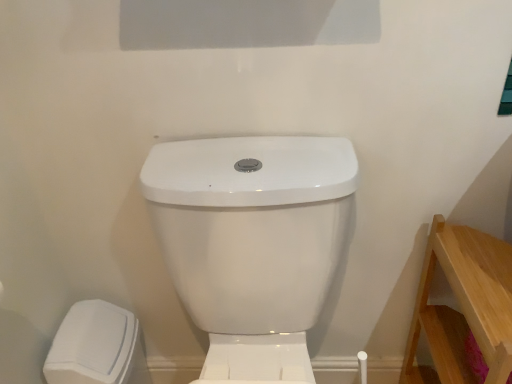
Question: Is white matte trash can at lower left closer to camera compared to white glossy toilet at center?

Choices:
 (A) yes
 (B) no

Answer: (B)

Question: Does white matte trash can at lower left appear on the right side of white glossy toilet at center?

Choices:
 (A) yes
 (B) no

Answer: (B)

Question: Does white matte trash can at lower left have a smaller size compared to white glossy toilet at center?

Choices:
 (A) yes
 (B) no

Answer: (A)

Question: Does white matte trash can at lower left come behind white glossy toilet at center?

Choices:
 (A) yes
 (B) no

Answer: (A)

Question: From a real-world perspective, is white matte trash can at lower left beneath white glossy toilet at center?

Choices:
 (A) yes
 (B) no

Answer: (A)

Question: Considering the relative sizes of white matte trash can at lower left and white glossy toilet at center in the image provided, is white matte trash can at lower left bigger than white glossy toilet at center?

Choices:
 (A) no
 (B) yes

Answer: (A)

Question: Could you tell me if light wood/rough wooden stool at lower right is facing white glossy toilet at center?

Choices:
 (A) yes
 (B) no

Answer: (B)

Question: Is white glossy toilet at center completely or partially inside light wood/rough wooden stool at lower right?

Choices:
 (A) no
 (B) yes

Answer: (A)

Question: Is light wood/rough wooden stool at lower right not within white glossy toilet at center?

Choices:
 (A) yes
 (B) no

Answer: (A)

Question: Is light wood/rough wooden stool at lower right facing away from white glossy toilet at center?

Choices:
 (A) no
 (B) yes

Answer: (A)

Question: From a real-world perspective, is light wood/rough wooden stool at lower right physically below white glossy toilet at center?

Choices:
 (A) no
 (B) yes

Answer: (B)

Question: Considering the relative sizes of light wood/rough wooden stool at lower right and white glossy toilet at center in the image provided, is light wood/rough wooden stool at lower right thinner than white glossy toilet at center?

Choices:
 (A) yes
 (B) no

Answer: (A)

Question: From the image's perspective, is white glossy toilet at center under light wood/rough wooden stool at lower right?

Choices:
 (A) yes
 (B) no

Answer: (B)